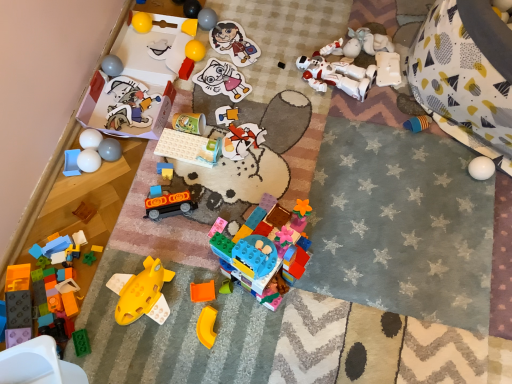
Where is `free space behind yellow matte plastic piece at center, the seventeenth toy viewed from the left`? The height and width of the screenshot is (384, 512). free space behind yellow matte plastic piece at center, the seventeenth toy viewed from the left is located at coordinates (195, 275).